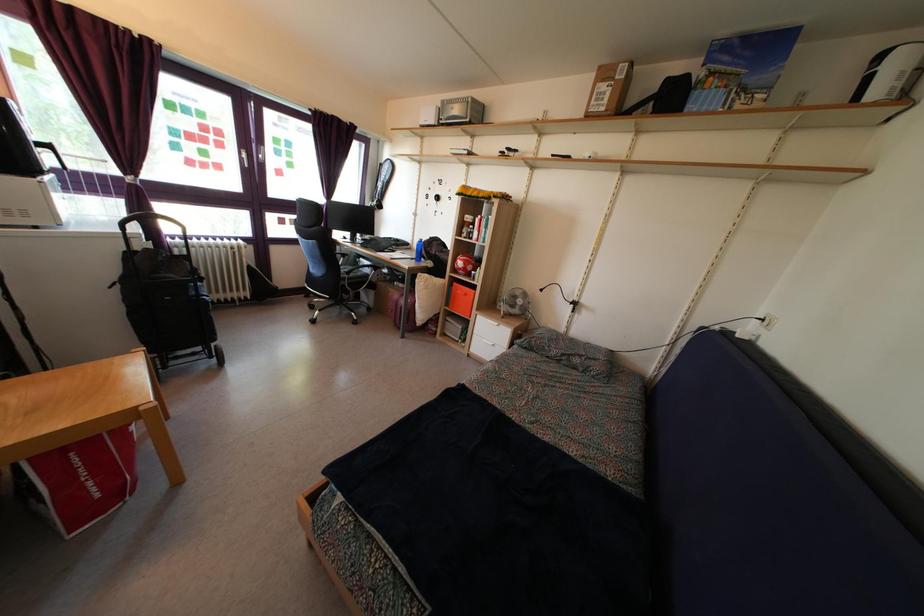
Describe the element at coordinates (356, 278) in the screenshot. The image size is (924, 616). I see `the chair sitting surface` at that location.